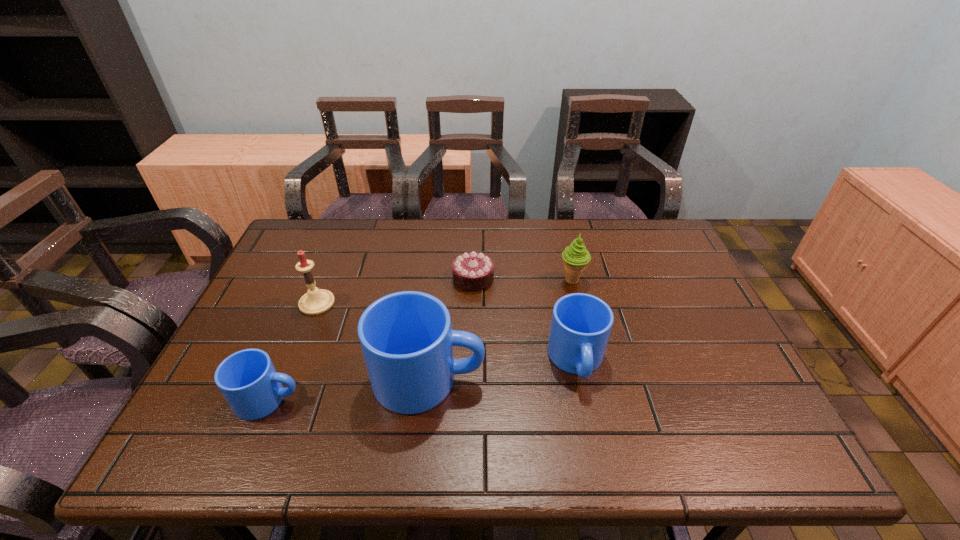
The image size is (960, 540). In order to click on free spot at the far left corner of the desktop in this screenshot , I will do 308,237.

This screenshot has width=960, height=540. Identify the location of vacant area at the far right corner. (653, 254).

This screenshot has width=960, height=540. I want to click on free point between the tallest mug and the icecream, so click(x=500, y=330).

At what (x,y) coordinates should I click in order to perform the action: click on vacant area that lies between the tallest mug and the fourth tallest object. Please return your answer as a coordinate pair (x, y). The width and height of the screenshot is (960, 540). Looking at the image, I should click on (503, 370).

Find the location of a particular element. The width and height of the screenshot is (960, 540). free space that is in between the rightmost mug and the shortest object is located at coordinates (525, 319).

The height and width of the screenshot is (540, 960). What are the coordinates of `free area in between the icecream and the candle` in the screenshot? It's located at (444, 292).

In order to click on object that ranks as the closest to the second mug from left to right in this screenshot , I will do `click(247, 379)`.

Identify which object is the third closest to the shortest mug. Please provide its 2D coordinates. Your answer should be formatted as a tuple, i.e. [(x, y)], where the tuple contains the x and y coordinates of a point satisfying the conditions above.

[(472, 271)]

This screenshot has height=540, width=960. Find the location of `mug object that ranks as the closest to the fourth tallest object`. mug object that ranks as the closest to the fourth tallest object is located at coordinates (406, 337).

Identify which mug is the second nearest to the tallest mug. Please provide its 2D coordinates. Your answer should be formatted as a tuple, i.e. [(x, y)], where the tuple contains the x and y coordinates of a point satisfying the conditions above.

[(581, 323)]